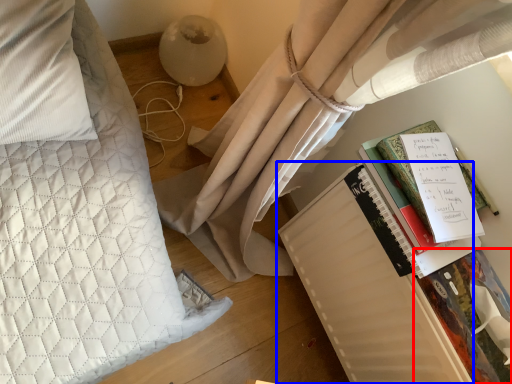
Question: Which object is closer to the camera taking this photo, paperback book (highlighted by a red box) or paperback book (highlighted by a blue box)?

Choices:
 (A) paperback book
 (B) paperback book

Answer: (A)